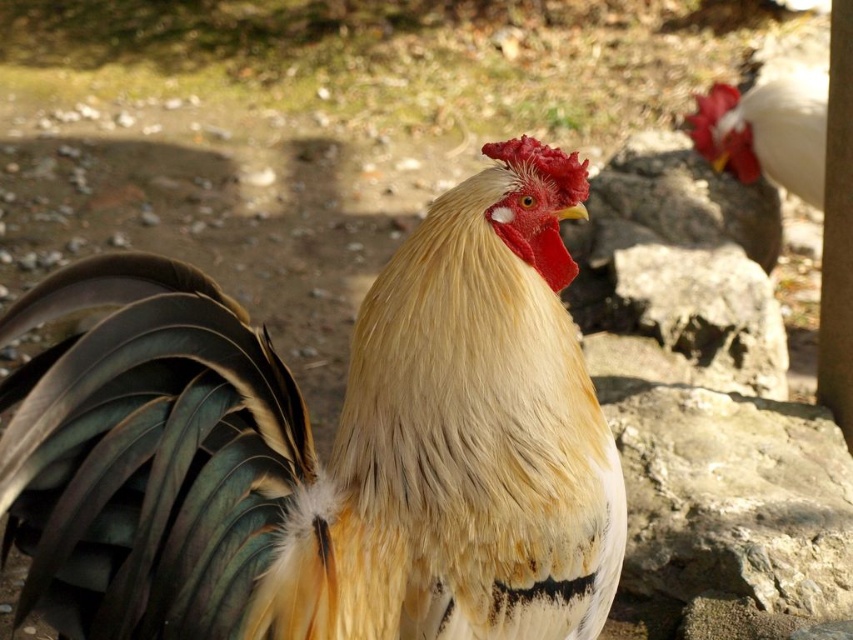
Consider the image. You are standing in a field and see two points in the scene. The first point is labeled as point (x=137, y=593) and the second is point (x=741, y=152). Which point is closer to you?

Point (x=137, y=593) is closer to you because it is in front of point (x=741, y=152).

You are a farmer checking the distance between the golden feathered rooster at center and the white glossy rooster at upper right. According to the image, how far apart are they?

The golden feathered rooster at center is 9.10 feet from the white glossy rooster at upper right, so they are 9.10 feet apart.

You are a farmer observing the roosters in your coop. You notice two roosters in the image. Which rooster is closer to you, the golden feathered rooster at center or the white glossy rooster at upper right?

The golden feathered rooster at center is closer to you because it is in front of the white glossy rooster at upper right.